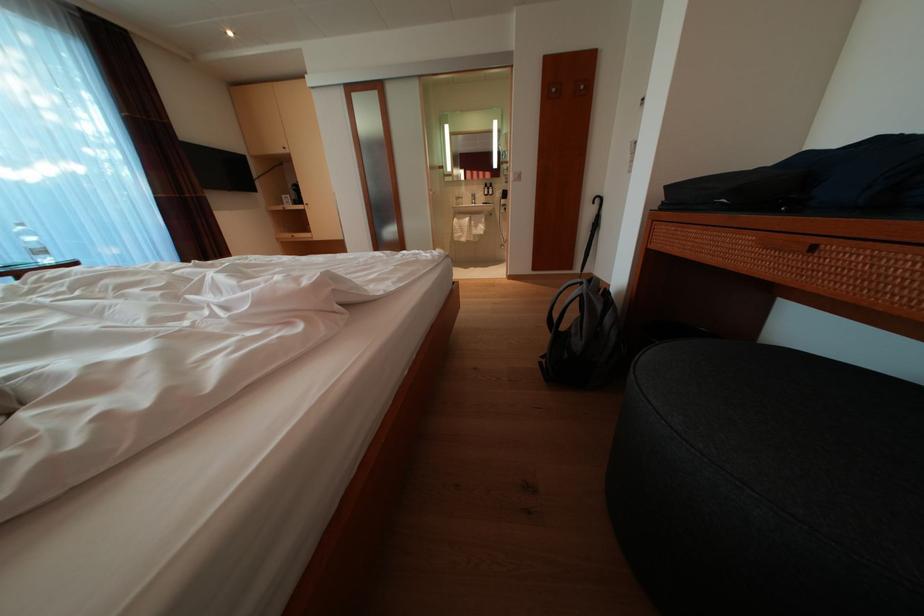
Locate an element on the screen. drawer handle cutout is located at coordinates (786, 243).